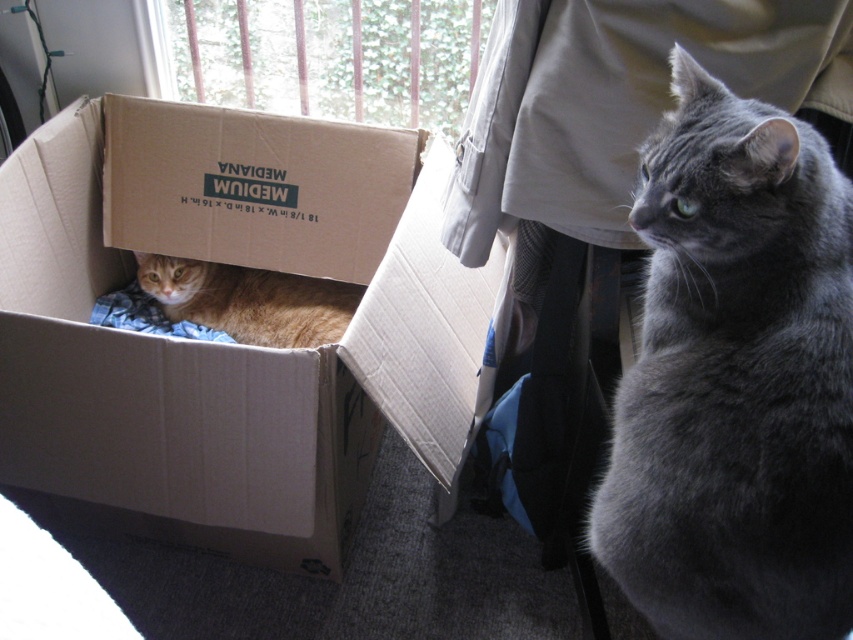
Can you confirm if cardboard box at left is positioned above orange tabby cat at left?

Yes, cardboard box at left is above orange tabby cat at left.

Does cardboard box at left have a larger size compared to orange tabby cat at left?

Yes.

The image size is (853, 640). I want to click on cardboard box at left, so click(x=218, y=378).

Is gray fluffy cat at center positioned behind orange tabby cat at left?

That is False.

The height and width of the screenshot is (640, 853). What do you see at coordinates (735, 380) in the screenshot?
I see `gray fluffy cat at center` at bounding box center [735, 380].

Locate an element on the screen. The width and height of the screenshot is (853, 640). gray fluffy cat at center is located at coordinates (735, 380).

Can you confirm if cardboard box at left is taller than gray fluffy cat at center?

Indeed, cardboard box at left has a greater height compared to gray fluffy cat at center.

Is cardboard box at left smaller than gray fluffy cat at center?

No, cardboard box at left is not smaller than gray fluffy cat at center.

You are a GUI agent. You are given a task and a screenshot of the screen. Output one action in this format:
    pyautogui.click(x=<x>, y=<y>)
    Task: Click on the cardboard box at left
    This screenshot has height=640, width=853.
    Given the screenshot: What is the action you would take?
    pyautogui.click(x=218, y=378)

At what (x,y) coordinates should I click in order to perform the action: click on cardboard box at left. Please return your answer as a coordinate pair (x, y). The width and height of the screenshot is (853, 640). Looking at the image, I should click on (218, 378).